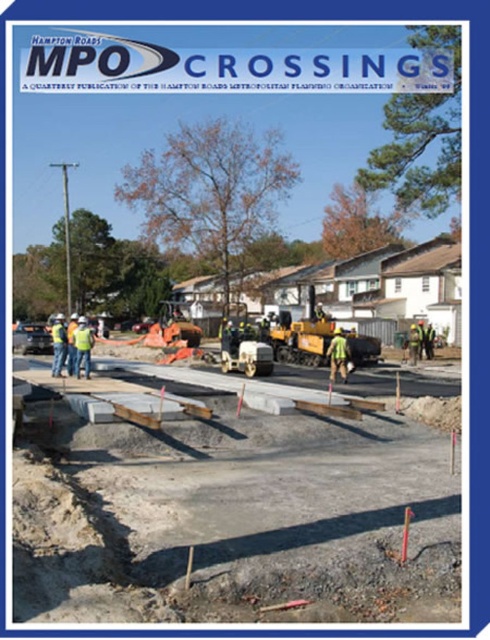
Question: Which is nearer to the green reflective vest at center?

Choices:
 (A) yellow asphalt paver at center
 (B) gray concrete slabs at center

Answer: (B)

Question: Is gray concrete slabs at center behind green reflective safety vest at center?

Choices:
 (A) yes
 (B) no

Answer: (B)

Question: Does green reflective vest at center appear on the right side of green reflective safety vest at center?

Choices:
 (A) no
 (B) yes

Answer: (A)

Question: Does yellow asphalt paver at center come behind green reflective safety vest at center?

Choices:
 (A) yes
 (B) no

Answer: (A)

Question: Which point is closer to the camera?

Choices:
 (A) (294, 330)
 (B) (69, 337)
 (C) (76, 349)

Answer: (C)

Question: Which point appears farthest from the camera in this image?

Choices:
 (A) (289, 433)
 (B) (90, 346)

Answer: (B)